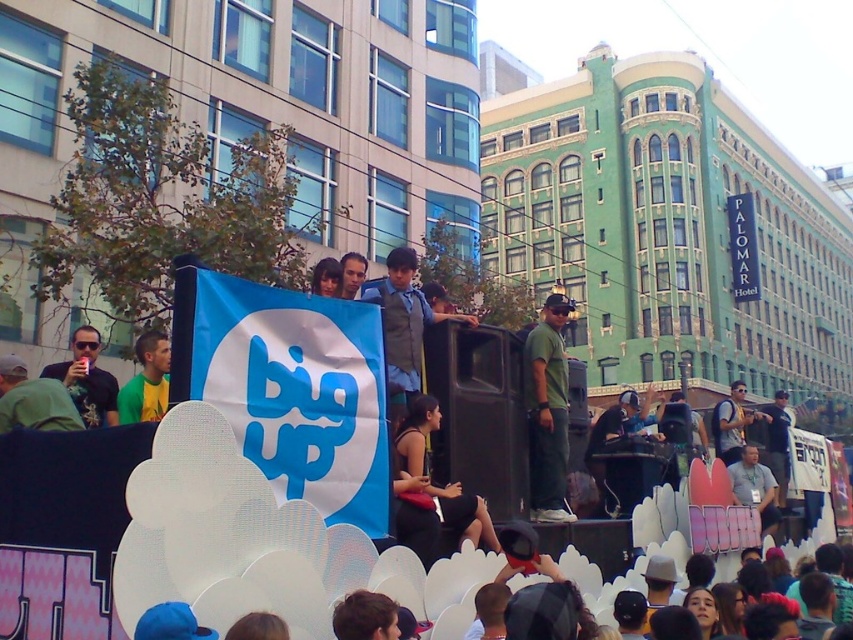
You are standing at the center of the street and see the point at coordinates (753, 486). Which object is this point located on?

The point at coordinates (753, 486) is located on the light blue fabric banner at center.

You are a photographer trying to capture both the light blue fabric banner at center and the smooth skin face at center in a single shot. Given that your camera can only focus on one subject at a time, which subject should you prioritize focusing on to ensure it appears sharp and clear in the photo?

You should prioritize focusing on the light blue fabric banner at center because it is bigger than the smooth skin face at center, making it more likely to require precise focus to maintain clarity.

You are a photographer standing in the crowd at the lively street scene. You want to take a photo of both the dark blue jeans at center and the smooth skin face at center. Which object should you focus on first to ensure both are in clear view?

The dark blue jeans at center is closer to you than the smooth skin face at center, so you should focus on the dark blue jeans at center first to ensure both are in clear view.